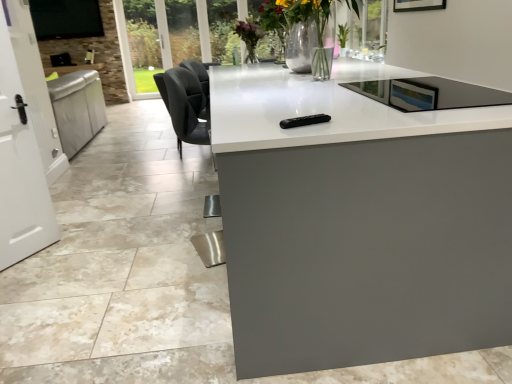
Describe the element at coordinates (25, 141) in the screenshot. The image size is (512, 384). I see `white glossy door at left` at that location.

I want to click on black leather swivel chair at center, so click(x=186, y=107).

The image size is (512, 384). What do you see at coordinates (359, 222) in the screenshot? I see `white glossy countertop at center` at bounding box center [359, 222].

The height and width of the screenshot is (384, 512). Find the location of `white glossy door at left`. white glossy door at left is located at coordinates (25, 141).

Is the surface of translucent glass vase at center in direct contact with white glossy door at left?

They are not placed beside each other.

From the picture: Relative to white glossy door at left, is translucent glass vase at center in front or behind?

translucent glass vase at center is positioned farther from the viewer than white glossy door at left.

In terms of width, does black leather swivel chair at center look wider or thinner when compared to white glossy door at left?

black leather swivel chair at center is wider than white glossy door at left.

Can you confirm if black leather swivel chair at center is shorter than white glossy door at left?

Correct, black leather swivel chair at center is not as tall as white glossy door at left.

Can you confirm if black leather swivel chair at center is positioned to the right of white glossy door at left?

Yes.

From a real-world perspective, who is located higher, black leather swivel chair at center or white glossy door at left?

white glossy door at left, from a real-world perspective.

Is the position of translucent glass vase at center less distant than that of black leather swivel chair at center?

Yes, it is.

Between translucent glass vase at center and black leather swivel chair at center, which one has less height?

translucent glass vase at center is shorter.

From the image's perspective, which is below, translucent glass vase at center or black leather swivel chair at center?

black leather swivel chair at center is shown below in the image.

Which is closer to the camera, (207, 115) or (59, 26)?

Point (207, 115) is closer to the camera than point (59, 26).

Between black leather swivel chair at center and black glass tv at upper left, which one has smaller size?

Smaller between the two is black glass tv at upper left.

Locate an element on the screen. Image resolution: width=512 pixels, height=384 pixels. window screen located above the black leather swivel chair at center (from the image's perspective) is located at coordinates (66, 19).

Can you confirm if black leather swivel chair at center is taller than black glass tv at upper left?

Yes, black leather swivel chair at center is taller than black glass tv at upper left.

Considering the relative sizes of black glass tv at upper left and black leather swivel chair at center in the image provided, is black glass tv at upper left smaller than black leather swivel chair at center?

Yes, black glass tv at upper left is smaller than black leather swivel chair at center.

Find the location of a particular element. swivel chair located underneath the black glass tv at upper left (from a real-world perspective) is located at coordinates (186, 107).

Is black glass tv at upper left directly adjacent to black leather swivel chair at center?

black glass tv at upper left and black leather swivel chair at center are not in contact.

Is black glass tv at upper left in front of black leather swivel chair at center?

No, it is behind black leather swivel chair at center.

Is white glossy door at left to the right of black glass tv at upper left from the viewer's perspective?

Yes.

I want to click on screen door below the black glass tv at upper left (from a real-world perspective), so click(x=25, y=141).

Is white glossy door at left looking in the opposite direction of black glass tv at upper left?

No.

From the image's perspective, which one is positioned higher, white glossy door at left or black glass tv at upper left?

black glass tv at upper left.

Is black leather swivel chair at center not close to translucent glass vase at center?

That's not correct — black leather swivel chair at center is a little close to translucent glass vase at center.

From a real-world perspective, is black leather swivel chair at center positioned under translucent glass vase at center based on gravity?

Indeed, from a real-world perspective, black leather swivel chair at center is positioned beneath translucent glass vase at center.

From the image's perspective, would you say black leather swivel chair at center is shown under translucent glass vase at center?

Yes, from the image's perspective, black leather swivel chair at center is below translucent glass vase at center.

Considering the sizes of black leather swivel chair at center and translucent glass vase at center in the image, is black leather swivel chair at center wider or thinner than translucent glass vase at center?

Considering their sizes, black leather swivel chair at center looks broader than translucent glass vase at center.

This screenshot has height=384, width=512. What are the coordinates of `floral arrangement behind the white glossy door at left` in the screenshot? It's located at (298, 21).

Where is `swivel chair below the white glossy door at left (from a real-world perspective)`? Image resolution: width=512 pixels, height=384 pixels. swivel chair below the white glossy door at left (from a real-world perspective) is located at coordinates (186, 107).

Estimate the real-world distances between objects in this image. Which object is closer to black glass tv at upper left, black leather swivel chair at center or translucent glass vase at center?

Based on the image, translucent glass vase at center appears to be nearer to black glass tv at upper left.

Looking at the image, which one is located closer to white glossy door at left, white glossy countertop at center or black leather swivel chair at center?

black leather swivel chair at center is closer to white glossy door at left.

In the scene shown: From the image, which object appears to be farther from translucent glass vase at center, white glossy countertop at center or black leather swivel chair at center?

white glossy countertop at center is further to translucent glass vase at center.

Which object lies nearer to the anchor point white glossy door at left, white glossy countertop at center or translucent glass vase at center?

Based on the image, translucent glass vase at center appears to be nearer to white glossy door at left.

Based on their spatial positions, is white glossy door at left or white glossy countertop at center further from translucent glass vase at center?

white glossy door at left.

Which object lies nearer to the anchor point white glossy countertop at center, translucent glass vase at center or white glossy door at left?

The object closer to white glossy countertop at center is translucent glass vase at center.

Considering their positions, is white glossy countertop at center positioned closer to black leather swivel chair at center than black glass tv at upper left?

white glossy countertop at center is positioned closer to the anchor black leather swivel chair at center.

When comparing their distances from black glass tv at upper left, does white glossy door at left or white glossy countertop at center seem closer?

white glossy door at left lies closer to black glass tv at upper left than the other object.

Identify the location of screen door between white glossy countertop at center and black leather swivel chair at center along the z-axis. This screenshot has width=512, height=384. (25, 141).

At what (x,y) coordinates should I click in order to perform the action: click on floral arrangement between white glossy door at left and black glass tv at upper left from front to back. Please return your answer as a coordinate pair (x, y). The image size is (512, 384). Looking at the image, I should click on (298, 21).

Image resolution: width=512 pixels, height=384 pixels. I want to click on floral arrangement between white glossy countertop at center and black glass tv at upper left along the z-axis, so click(x=298, y=21).

Find the location of `floral arrangement between white glossy door at left and black leather swivel chair at center from front to back`. floral arrangement between white glossy door at left and black leather swivel chair at center from front to back is located at coordinates (298, 21).